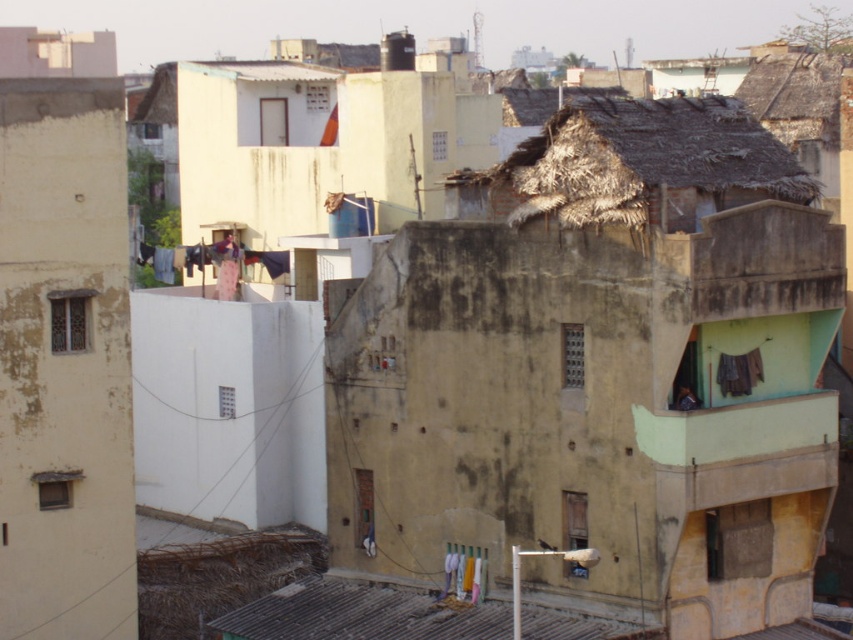
Question: Based on their relative distances, which object is farther from the matte yellow wall at left?

Choices:
 (A) white fabric at center
 (B) brown fabric at right

Answer: (B)

Question: Can you confirm if matte yellow wall at left is bigger than white fabric at center?

Choices:
 (A) no
 (B) yes

Answer: (B)

Question: Is matte yellow wall at left to the left of brown fabric at right from the viewer's perspective?

Choices:
 (A) yes
 (B) no

Answer: (A)

Question: Among these points, which one is farthest from the camera?

Choices:
 (A) (445, 621)
 (B) (740, 356)
 (C) (463, 593)

Answer: (C)

Question: Observing the image, what is the correct spatial positioning of brown thatch roof at upper center in reference to white fabric at center?

Choices:
 (A) right
 (B) left

Answer: (A)

Question: Which of the following is the farthest from the observer?

Choices:
 (A) white fabric at center
 (B) brown thatch roof at upper center
 (C) rusty corrugated metal roof at lower center
 (D) brown fabric at right

Answer: (A)